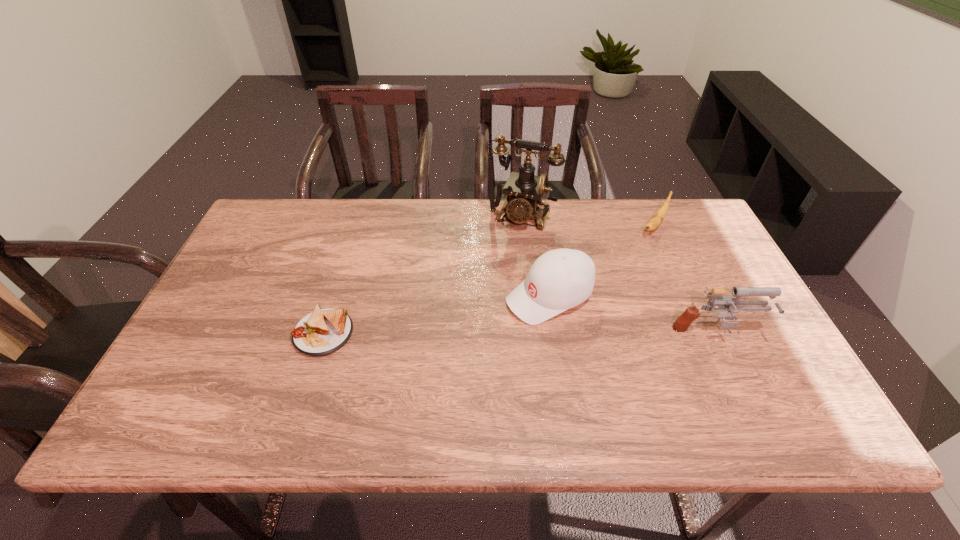
This screenshot has width=960, height=540. I want to click on unoccupied area between the shortest object and the banana, so click(x=489, y=280).

I want to click on empty location between the telephone and the baseball cap, so click(535, 256).

Locate an element on the screen. blank region between the sandwich and the banana is located at coordinates (489, 280).

You are a GUI agent. You are given a task and a screenshot of the screen. Output one action in this format:
    pyautogui.click(x=<x>, y=<y>)
    Task: Click on the vacant point located between the telephone and the shortest object
    This screenshot has height=540, width=960.
    Given the screenshot: What is the action you would take?
    pyautogui.click(x=422, y=275)

Identify the location of vacant region between the telephone and the leftmost object. Image resolution: width=960 pixels, height=540 pixels. (422, 275).

Find the location of a particular element. free area in between the shortest object and the tallest object is located at coordinates (422, 275).

Where is `object that is the nearest to the third shortest object`? object that is the nearest to the third shortest object is located at coordinates (524, 190).

Choose which object is the third nearest neighbor to the leftmost object. Please provide its 2D coordinates. Your answer should be formatted as a tuple, i.e. [(x, y)], where the tuple contains the x and y coordinates of a point satisfying the conditions above.

[(725, 303)]

Locate an element on the screen. This screenshot has height=540, width=960. blank space that satisfies the following two spatial constraints: 1. on the front side of the gun; 2. at the barrel end of the second shortest object is located at coordinates (703, 334).

The image size is (960, 540). I want to click on free space that satisfies the following two spatial constraints: 1. on the back side of the second shortest object; 2. on the right side of the baseball cap, so click(x=539, y=226).